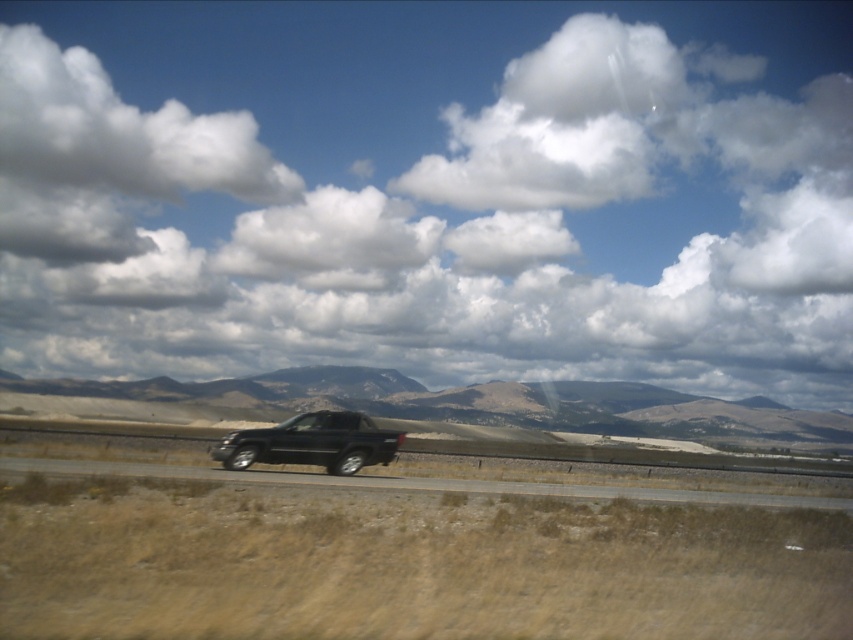
Question: Is glossy black truck at center below transparent glass window at center?

Choices:
 (A) no
 (B) yes

Answer: (B)

Question: Which object is positioned closest to the white fluffy cloud at upper center?

Choices:
 (A) glossy black truck at center
 (B) black asphalt highway at center
 (C) transparent glass window at center

Answer: (A)

Question: Does black asphalt highway at center appear on the right side of transparent glass window at center?

Choices:
 (A) yes
 (B) no

Answer: (A)

Question: Which object is the farthest from the white fluffy cloud at upper center?

Choices:
 (A) black asphalt highway at center
 (B) transparent glass window at center
 (C) glossy black truck at center

Answer: (B)

Question: Is white fluffy cloud at upper center above black asphalt highway at center?

Choices:
 (A) no
 (B) yes

Answer: (B)

Question: Which object appears farthest from the camera in this image?

Choices:
 (A) glossy black truck at center
 (B) transparent glass window at center

Answer: (B)